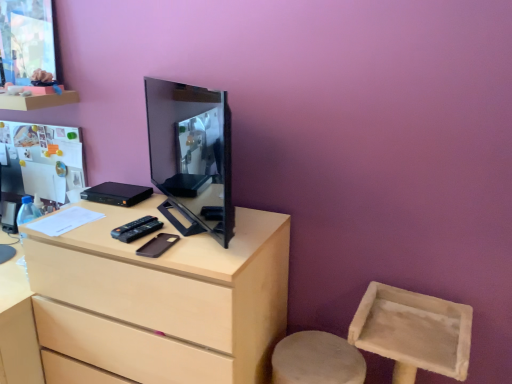
Question: Is light wood chest of drawers at center wider or thinner than matte wood shelf at upper left?

Choices:
 (A) wide
 (B) thin

Answer: (A)

Question: Does point pos(142,284) appear closer or farther from the camera than point pos(76,102)?

Choices:
 (A) closer
 (B) farther

Answer: (A)

Question: Which of these objects is positioned farthest from the matte wood shelf at upper left?

Choices:
 (A) black glossy monitor at center
 (B) light wood chest of drawers at center

Answer: (B)

Question: Estimate the real-world distances between objects in this image. Which object is farther from the black glossy monitor at center?

Choices:
 (A) light wood chest of drawers at center
 (B) matte wood shelf at upper left

Answer: (B)